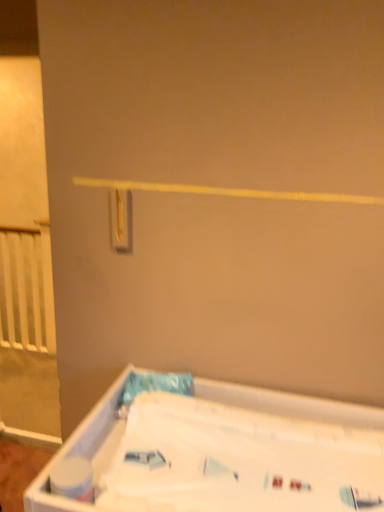
Question: Is white matte toilet paper at lower left outside gold metallic light switch at upper center?

Choices:
 (A) yes
 (B) no

Answer: (A)

Question: From a real-world perspective, is white matte toilet paper at lower left positioned over gold metallic light switch at upper center based on gravity?

Choices:
 (A) no
 (B) yes

Answer: (A)

Question: Can you confirm if white matte toilet paper at lower left is thinner than gold metallic light switch at upper center?

Choices:
 (A) no
 (B) yes

Answer: (A)

Question: Considering the relative sizes of white matte toilet paper at lower left and gold metallic light switch at upper center in the image provided, is white matte toilet paper at lower left wider than gold metallic light switch at upper center?

Choices:
 (A) no
 (B) yes

Answer: (B)

Question: From the image's perspective, would you say white matte toilet paper at lower left is positioned over gold metallic light switch at upper center?

Choices:
 (A) no
 (B) yes

Answer: (A)

Question: Is white matte toilet paper at lower left oriented away from gold metallic light switch at upper center?

Choices:
 (A) yes
 (B) no

Answer: (B)

Question: Is white plastic bathtub at lower right wider than gold metallic light switch at upper center?

Choices:
 (A) no
 (B) yes

Answer: (B)

Question: Is white plastic bathtub at lower right not inside gold metallic light switch at upper center?

Choices:
 (A) no
 (B) yes

Answer: (B)

Question: Are white plastic bathtub at lower right and gold metallic light switch at upper center located far from each other?

Choices:
 (A) yes
 (B) no

Answer: (B)

Question: Is white plastic bathtub at lower right facing towards gold metallic light switch at upper center?

Choices:
 (A) no
 (B) yes

Answer: (A)

Question: Are white plastic bathtub at lower right and gold metallic light switch at upper center beside each other?

Choices:
 (A) yes
 (B) no

Answer: (B)

Question: Is white plastic bathtub at lower right turned away from gold metallic light switch at upper center?

Choices:
 (A) no
 (B) yes

Answer: (A)

Question: Is gold metallic light switch at upper center at the right side of white plastic bathtub at lower right?

Choices:
 (A) no
 (B) yes

Answer: (A)